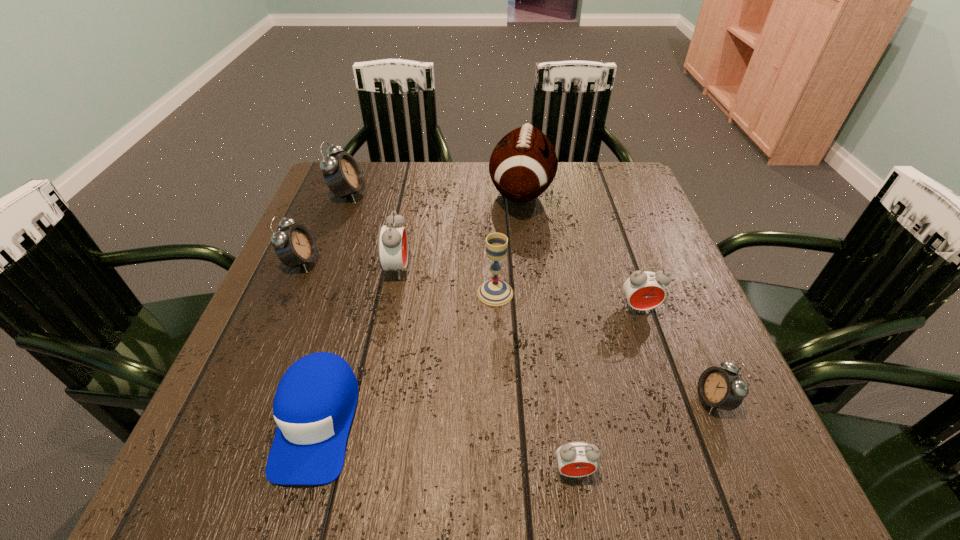
You are a GUI agent. You are given a task and a screenshot of the screen. Output one action in this format:
    pyautogui.click(x=<x>, y=<y>)
    Task: Click on the vacant space located 0.100m on the face of the rightmost alarm clock
    
    Given the screenshot: What is the action you would take?
    pyautogui.click(x=638, y=400)

Find the location of a particular element. Image resolution: width=960 pixels, height=540 pixels. vacant space located on the face of the rightmost alarm clock is located at coordinates (610, 400).

This screenshot has height=540, width=960. In order to click on vacant space located 0.220m on the face of the rightmost alarm clock in this screenshot , I will do `click(568, 400)`.

Locate an element on the screen. football (American) positioned at the far edge is located at coordinates (523, 164).

Identify the location of alarm clock that is at the far edge. (342, 174).

Where is `alarm clock at the near edge`? alarm clock at the near edge is located at coordinates (577, 458).

Identify the location of baseball cap that is positioned at the near edge. This screenshot has width=960, height=540. (314, 404).

The image size is (960, 540). Find the location of `baseball cap located at the left edge`. baseball cap located at the left edge is located at coordinates (314, 404).

Find the location of `object present at the far left corner`. object present at the far left corner is located at coordinates (342, 174).

Identify the location of object present at the near left corner. (314, 404).